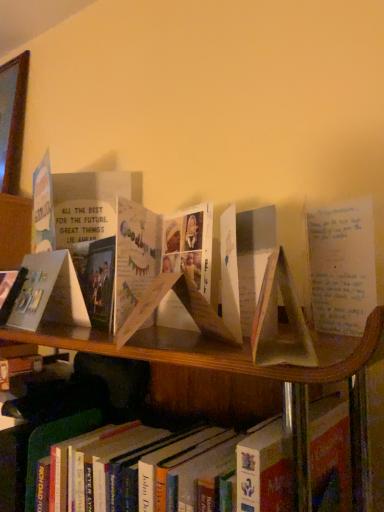
The width and height of the screenshot is (384, 512). Identify the location of matte paper card at left, acting as the first paperback book starting from the back. (49, 293).

You are a GUI agent. You are given a task and a screenshot of the screen. Output one action in this format:
    pyautogui.click(x=<x>, y=<y>)
    Task: Click on the matte paper book at center, which is counted as the 2th paperback book, starting from the back
    The image size is (384, 512).
    Given the screenshot: What is the action you would take?
    pyautogui.click(x=244, y=264)

Is matte paper card at left, marked as the 2th paperback book in a right-to-left arrangement, wider or thinner than hardcover book at lower center?

Considering their sizes, matte paper card at left, marked as the 2th paperback book in a right-to-left arrangement, looks slimmer than hardcover book at lower center.

Could you measure the distance between matte paper card at left, marked as the 2th paperback book in a right-to-left arrangement, and hardcover book at lower center?

The distance of matte paper card at left, marked as the 2th paperback book in a right-to-left arrangement, from hardcover book at lower center is 9.59 inches.

Is hardcover book at lower center at the back of matte paper card at left, the 2th paperback book viewed from the front?

No.

In the image, there is a matte paper card at left, acting as the first paperback book starting from the back. At what (x,y) coordinates should I click in order to perform the action: click on book below it (from the image's perspective). Please return your answer as a coordinate pair (x, y). Looking at the image, I should click on (160, 467).

Which is more to the left, matte paper book at center, the 2th paperback book in the left-to-right sequence, or matte paper card at left, which is the first paperback book from left to right?

Positioned to the left is matte paper card at left, which is the first paperback book from left to right.

Is matte paper book at center, which is counted as the 2th paperback book, starting from the back, outside of matte paper card at left, acting as the first paperback book starting from the back?

That's correct, matte paper book at center, which is counted as the 2th paperback book, starting from the back, is outside of matte paper card at left, acting as the first paperback book starting from the back.

Which is less distant, (256, 244) or (15, 312)?

Clearly, point (256, 244) is closer to the camera than point (15, 312).

Considering the sizes of matte paper book at center, which is counted as the 2th paperback book, starting from the back, and matte paper card at left, which is the first paperback book from left to right, in the image, is matte paper book at center, which is counted as the 2th paperback book, starting from the back, taller or shorter than matte paper card at left, which is the first paperback book from left to right,?

Considering their sizes, matte paper book at center, which is counted as the 2th paperback book, starting from the back, has less height than matte paper card at left, which is the first paperback book from left to right.

What's the angular difference between matte paper card at left, marked as the 2th paperback book in a right-to-left arrangement, and matte paper book at center, positioned as the 1th paperback book in front-to-back order,'s facing directions?

The angular difference between matte paper card at left, marked as the 2th paperback book in a right-to-left arrangement, and matte paper book at center, positioned as the 1th paperback book in front-to-back order, is 52.2 degrees.

From the image's perspective, is matte paper card at left, marked as the 2th paperback book in a right-to-left arrangement, below matte paper book at center, positioned as the 1th paperback book in front-to-back order?

Yes, from the image's perspective, matte paper card at left, marked as the 2th paperback book in a right-to-left arrangement, is beneath matte paper book at center, positioned as the 1th paperback book in front-to-back order.

Where is `paperback book above the matte paper book at center, positioned as the 1th paperback book in front-to-back order (from a real-world perspective)`? paperback book above the matte paper book at center, positioned as the 1th paperback book in front-to-back order (from a real-world perspective) is located at coordinates (49, 293).

Consider the image. Between matte paper card at left, which is the first paperback book from left to right, and matte paper book at center, which is the first paperback book in right-to-left order, which one is positioned behind?

matte paper card at left, which is the first paperback book from left to right, is behind.

Does matte paper book at center, the 2th paperback book in the left-to-right sequence, touch hardcover book at lower center?

matte paper book at center, the 2th paperback book in the left-to-right sequence, and hardcover book at lower center are not in contact.

From the picture: Measure the distance between matte paper book at center, which is the first paperback book in right-to-left order, and hardcover book at lower center.

The distance of matte paper book at center, which is the first paperback book in right-to-left order, from hardcover book at lower center is 9.06 inches.

Is matte paper book at center, positioned as the 1th paperback book in front-to-back order, positioned with its back to hardcover book at lower center?

No, hardcover book at lower center is not at the back of matte paper book at center, positioned as the 1th paperback book in front-to-back order.

Is matte paper book at center, which is counted as the 2th paperback book, starting from the back, positioned behind hardcover book at lower center?

No, matte paper book at center, which is counted as the 2th paperback book, starting from the back, is closer to the camera.

Who is bigger, hardcover book at lower center or matte paper card at left, the 2th paperback book viewed from the front?

hardcover book at lower center is bigger.

In the scene shown: Is hardcover book at lower center wider or thinner than matte paper card at left, acting as the first paperback book starting from the back?

Clearly, hardcover book at lower center has more width compared to matte paper card at left, acting as the first paperback book starting from the back.

How many degrees apart are the facing directions of hardcover book at lower center and matte paper card at left, which is the first paperback book from left to right?

There is a 14.1-degree angle between the facing directions of hardcover book at lower center and matte paper card at left, which is the first paperback book from left to right.

Between point (127, 475) and point (48, 298), which one is positioned in front?

The point (127, 475) is closer to the camera.

In the image, is hardcover book at lower center on the left side or the right side of matte paper book at center, which is counted as the 2th paperback book, starting from the back?

In the image, hardcover book at lower center appears on the left side of matte paper book at center, which is counted as the 2th paperback book, starting from the back.

From a real-world perspective, which is physically above, hardcover book at lower center or matte paper book at center, which is counted as the 2th paperback book, starting from the back?

matte paper book at center, which is counted as the 2th paperback book, starting from the back, from a real-world perspective.

From the picture: Is hardcover book at lower center aimed at matte paper book at center, the 2th paperback book in the left-to-right sequence?

No, hardcover book at lower center is not facing towards matte paper book at center, the 2th paperback book in the left-to-right sequence.

Which is closer to the camera, (220, 471) or (255, 224)?

Point (220, 471).

This screenshot has width=384, height=512. I want to click on book in front of the matte paper card at left, the 2th paperback book viewed from the front, so click(160, 467).

Where is `paperback book located below the matte paper book at center, positioned as the 1th paperback book in front-to-back order (from the image's perspective)`? This screenshot has width=384, height=512. paperback book located below the matte paper book at center, positioned as the 1th paperback book in front-to-back order (from the image's perspective) is located at coordinates (49, 293).

Considering their positions, is matte paper book at center, positioned as the 1th paperback book in front-to-back order, positioned further to hardcover book at lower center than matte paper card at left, acting as the first paperback book starting from the back?

The object further to hardcover book at lower center is matte paper card at left, acting as the first paperback book starting from the back.

Looking at the image, which one is located closer to matte paper card at left, the 2th paperback book viewed from the front, matte paper book at center, the 2th paperback book in the left-to-right sequence, or hardcover book at lower center?

Among the two, hardcover book at lower center is located nearer to matte paper card at left, the 2th paperback book viewed from the front.

Estimate the real-world distances between objects in this image. Which object is further from matte paper book at center, positioned as the 1th paperback book in front-to-back order, hardcover book at lower center or matte paper card at left, the 2th paperback book viewed from the front?

Among the two, matte paper card at left, the 2th paperback book viewed from the front, is located further to matte paper book at center, positioned as the 1th paperback book in front-to-back order.

Looking at the image, which one is located further to matte paper card at left, acting as the first paperback book starting from the back, hardcover book at lower center or matte paper book at center, which is counted as the 2th paperback book, starting from the back?

matte paper book at center, which is counted as the 2th paperback book, starting from the back, is further to matte paper card at left, acting as the first paperback book starting from the back.

In the scene shown: Considering their positions, is matte paper card at left, marked as the 2th paperback book in a right-to-left arrangement, positioned closer to matte paper book at center, positioned as the 1th paperback book in front-to-back order, than hardcover book at lower center?

hardcover book at lower center is closer to matte paper book at center, positioned as the 1th paperback book in front-to-back order.

Based on the photo, looking at the image, which one is located further to hardcover book at lower center, matte paper card at left, the 2th paperback book viewed from the front, or matte paper book at center, positioned as the 1th paperback book in front-to-back order?

matte paper card at left, the 2th paperback book viewed from the front, lies further to hardcover book at lower center than the other object.

At what (x,y) coordinates should I click in order to perform the action: click on paperback book that lies between matte paper book at center, which is the first paperback book in right-to-left order, and hardcover book at lower center from top to bottom. Please return your answer as a coordinate pair (x, y). Image resolution: width=384 pixels, height=512 pixels. Looking at the image, I should click on (49, 293).